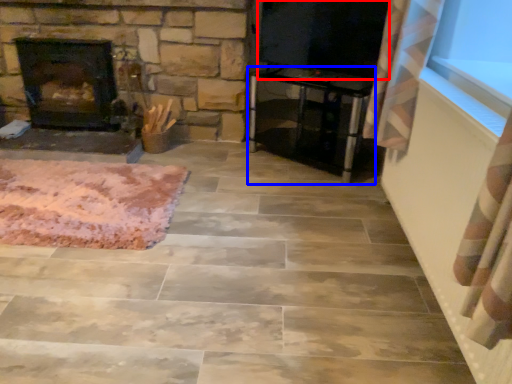
Question: Among these objects, which one is nearest to the camera, window screen (highlighted by a red box) or furniture (highlighted by a blue box)?

Choices:
 (A) window screen
 (B) furniture

Answer: (A)